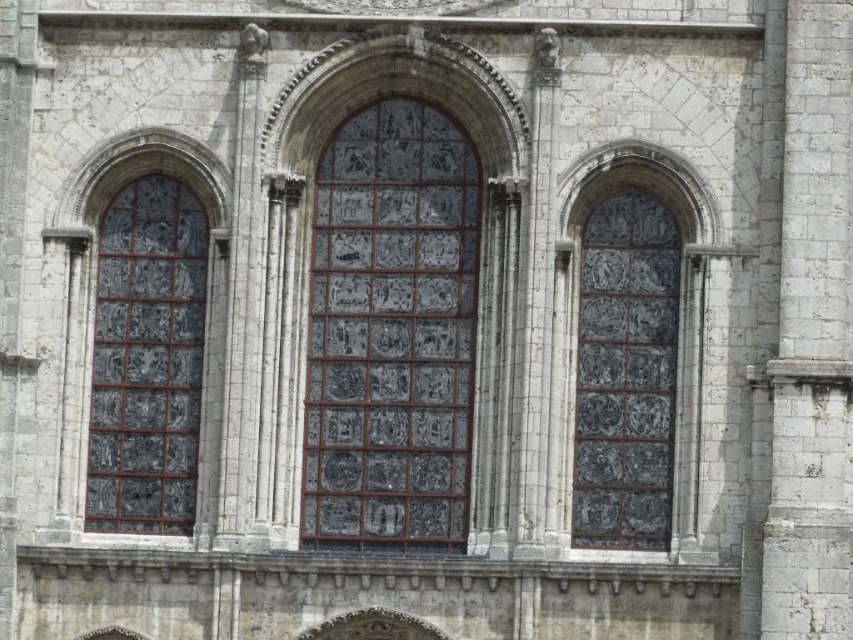
Question: Does dark glass window at center appear on the left side of stained glass window at left?

Choices:
 (A) no
 (B) yes

Answer: (A)

Question: Is stained glass window at center positioned in front of dark glass window at center?

Choices:
 (A) yes
 (B) no

Answer: (A)

Question: Based on their relative distances, which object is farther from the stained glass window at left?

Choices:
 (A) dark glass window at center
 (B) stained glass window at center

Answer: (A)

Question: Which point is farther to the camera?

Choices:
 (A) (338, 531)
 (B) (613, 412)

Answer: (A)

Question: Which of the following is the closest to the observer?

Choices:
 (A) (642, 474)
 (B) (328, 252)
 (C) (144, 403)

Answer: (A)

Question: Does dark glass window at center have a smaller size compared to stained glass window at left?

Choices:
 (A) yes
 (B) no

Answer: (B)